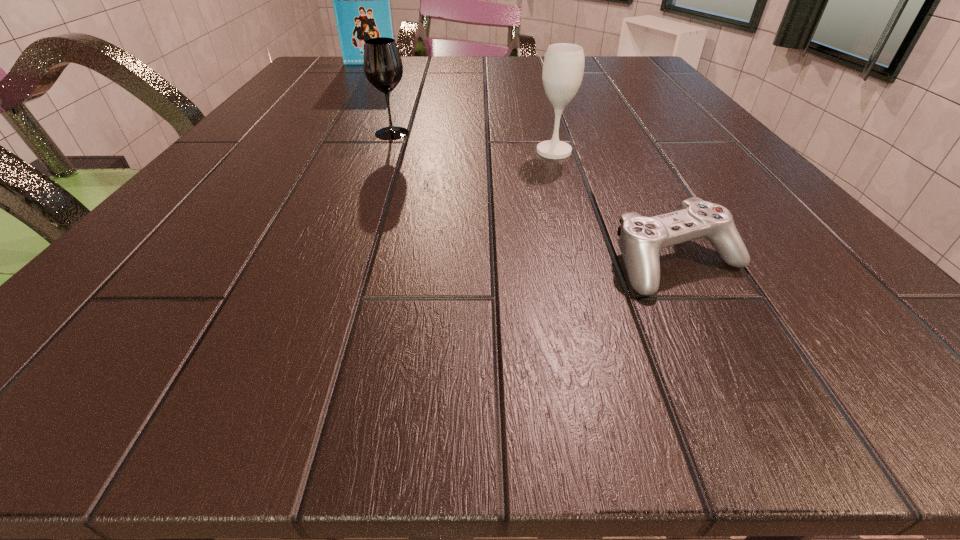
This screenshot has height=540, width=960. I want to click on vacant area that lies between the nearest object and the farthest object, so click(524, 163).

Select which object appears as the third closest to the left wineglass. Please provide its 2D coordinates. Your answer should be formatted as a tuple, i.e. [(x, y)], where the tuple contains the x and y coordinates of a point satisfying the conditions above.

[(641, 239)]

The width and height of the screenshot is (960, 540). Identify the location of object that is the closest to the nearer wineglass. (641, 239).

I want to click on vacant area in the image that satisfies the following two spatial constraints: 1. on the front cover of the third nearest object; 2. on the right side of the tallest object, so click(326, 133).

Where is `blank space that satisfies the following two spatial constraints: 1. on the front cover of the leftmost object; 2. on the right side of the right wineglass`? blank space that satisfies the following two spatial constraints: 1. on the front cover of the leftmost object; 2. on the right side of the right wineglass is located at coordinates (315, 151).

The height and width of the screenshot is (540, 960). I want to click on blank space that satisfies the following two spatial constraints: 1. on the front cover of the nearest object; 2. on the left side of the book, so click(x=244, y=262).

Locate an element on the screen. vacant point that satisfies the following two spatial constraints: 1. on the front cover of the tallest object; 2. on the right side of the left wineglass is located at coordinates point(326,133).

The width and height of the screenshot is (960, 540). I want to click on blank area in the image that satisfies the following two spatial constraints: 1. on the front cover of the farthest object; 2. on the left side of the right wineglass, so click(x=315, y=151).

This screenshot has height=540, width=960. What are the coordinates of `vacant point that satisfies the following two spatial constraints: 1. on the front cover of the second object from right to left; 2. on the left side of the tallest object` in the screenshot? It's located at (315, 151).

The width and height of the screenshot is (960, 540). In order to click on free space that satisfies the following two spatial constraints: 1. on the front cover of the tallest object; 2. on the left side of the rightmost object in this screenshot , I will do `click(244, 262)`.